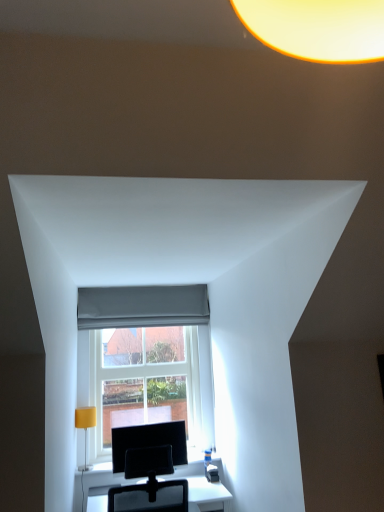
Question: In the image, is gray fabric curtain at center on the left side or the right side of white glossy table at center?

Choices:
 (A) left
 (B) right

Answer: (A)

Question: Is point (97, 287) positioned closer to the camera than point (107, 482)?

Choices:
 (A) farther
 (B) closer

Answer: (A)

Question: Based on their relative distances, which object is nearer to the black glossy monitor at center?

Choices:
 (A) white glossy table at center
 (B) gray fabric curtain at center
 (C) clear glass window at center
 (D) yellow fabric lampshade at left

Answer: (A)

Question: Which of these objects is positioned farthest from the gray fabric curtain at center?

Choices:
 (A) white glossy table at center
 (B) clear glass window at center
 (C) yellow fabric lampshade at left
 (D) black glossy monitor at center

Answer: (A)